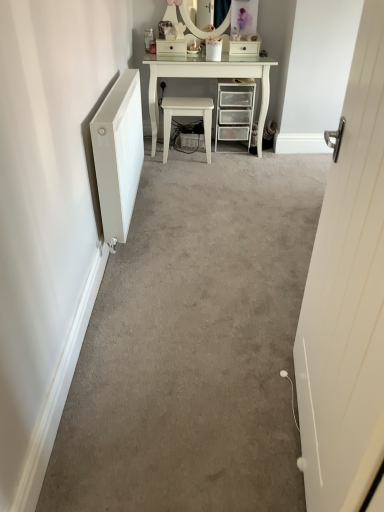
Where is `free space in front of clear plastic drawers at center`? This screenshot has height=512, width=384. free space in front of clear plastic drawers at center is located at coordinates (235, 159).